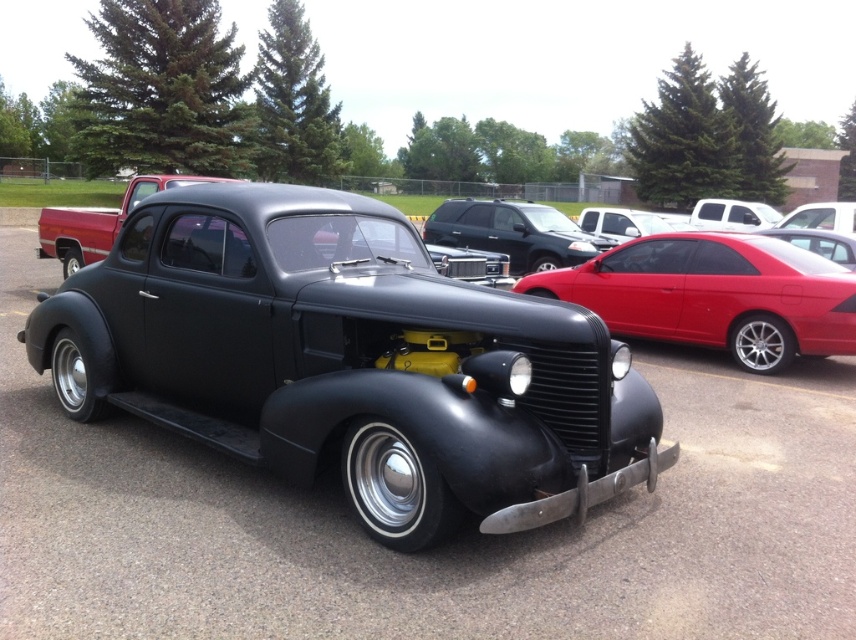
You are standing at the vintage black car with the open hood and want to walk straight ahead towards the grassy area with trees. There are two points marked on the ground in front of you at coordinates point (525, 586) and point (533, 227). Which point will you reach first?

Point (525, 586) is in front of point (533, 227), so you will reach point (525, 586) first.

You are a delivery person who needs to park a delivery van that is 2 meters tall. You see the matte black car at center and the matte black suv at center in the parking lot. Can you safely park your van between them without hitting the roof?

The matte black car at center is positioned under the matte black suv at center, meaning there is vertical space between them. Since the van is 2 meters tall, it can fit vertically between them as long as the vertical clearance is sufficient. However, the exact vertical distance isn not provided, so it depends on whether the space between them allows for the van height.